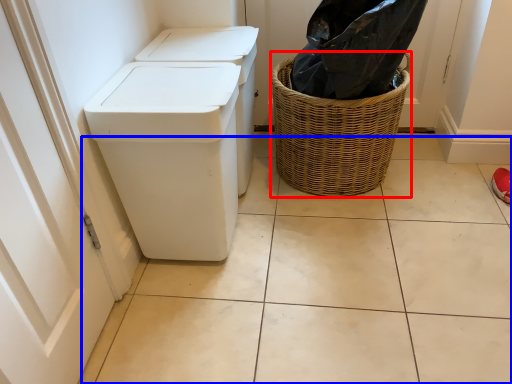
Question: Which object is further to the camera taking this photo, basket (highlighted by a red box) or tile (highlighted by a blue box)?

Choices:
 (A) basket
 (B) tile

Answer: (A)